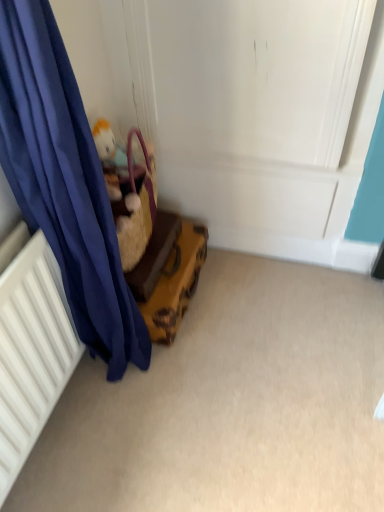
Question: Should I look upward or downward to see wooden suitcase at lower left?

Choices:
 (A) down
 (B) up

Answer: (A)